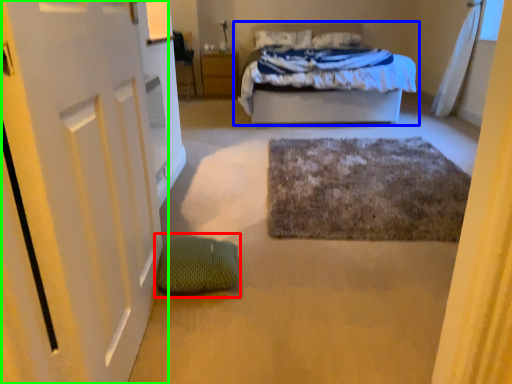
Question: Based on their relative distances, which object is nearer to bean bag chair (highlighted by a red box)? Choose from bed (highlighted by a blue box) and door (highlighted by a green box).

Choices:
 (A) bed
 (B) door

Answer: (B)